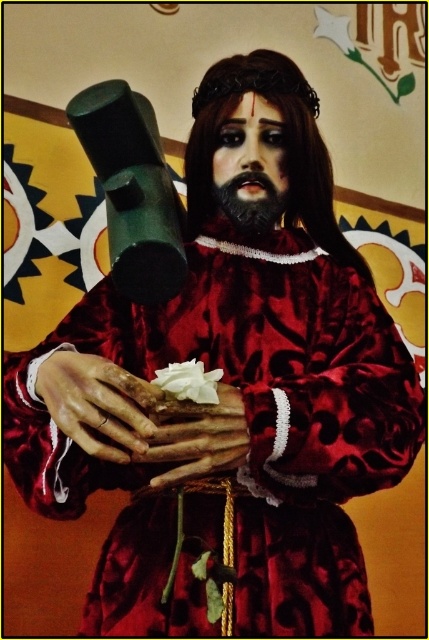
Question: Which point is closer to the camera taking this photo?

Choices:
 (A) (132, 410)
 (B) (274, 193)
 (C) (156, 417)

Answer: (A)

Question: Where is leather-like hand at center located in relation to black matte beard at center in the image?

Choices:
 (A) left
 (B) right

Answer: (A)

Question: Which point is closer to the camera taking this photo?

Choices:
 (A) (217, 196)
 (B) (187, 432)

Answer: (B)

Question: Is leather-like hand at center to the left of smooth leather gloves at center from the viewer's perspective?

Choices:
 (A) yes
 (B) no

Answer: (A)

Question: Which of these objects is positioned closest to the black matte beard at center?

Choices:
 (A) leather-like hand at center
 (B) smooth leather gloves at center

Answer: (B)

Question: Is the position of smooth leather gloves at center more distant than that of black matte beard at center?

Choices:
 (A) yes
 (B) no

Answer: (B)